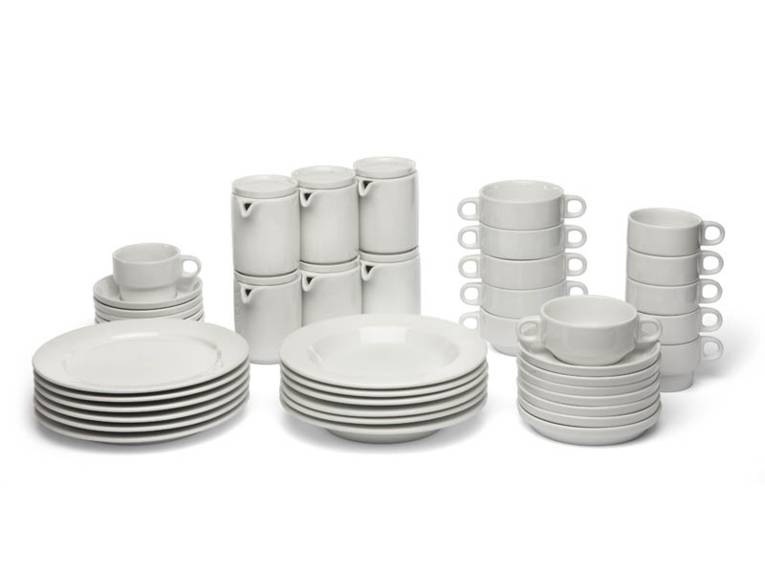
What are the coordinates of `soup bowls` in the screenshot? It's located at (521, 208), (518, 238), (510, 270), (506, 296), (496, 325).